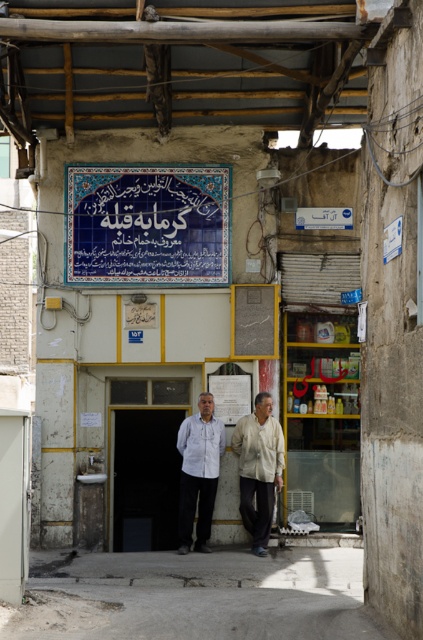
You are standing in front of the shop entrance. Where is the blue tile signboard at upper center relative to the entrance?

The blue tile signboard at upper center is located above the entrance, positioned at coordinates approximately 0.352 on the x and 0.350 on the y axis.

You are a delivery person trying to deliver a package to the shop. The address says to look for the blue tile signboard at upper center. However, there is also a white cotton shirt at center. Which object is higher up in the image?

The blue tile signboard at upper center is located above the white cotton shirt at center, so the blue tile signboard at upper center is higher up in the image.

You are a delivery person trying to deliver a package to the shop. You notice the blue tile signboard at upper center and the light beige fabric shirt at center. Which object is closer to the entrance of the shop?

The blue tile signboard at upper center is shorter than the light beige fabric shirt at center, so the light beige fabric shirt at center is closer to the entrance.